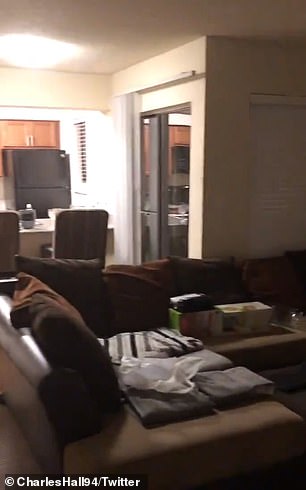
Image resolution: width=306 pixels, height=490 pixels. I want to click on white plastic bag on sofa, so click(x=156, y=372).